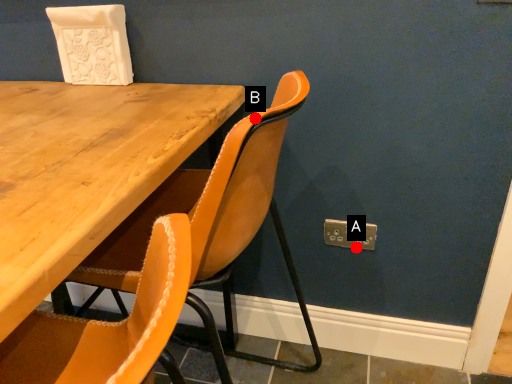
Question: Two points are circled on the image, labeled by A and B beside each circle. Which of the following is the farthest from the observer?

Choices:
 (A) A is further
 (B) B is further

Answer: (A)